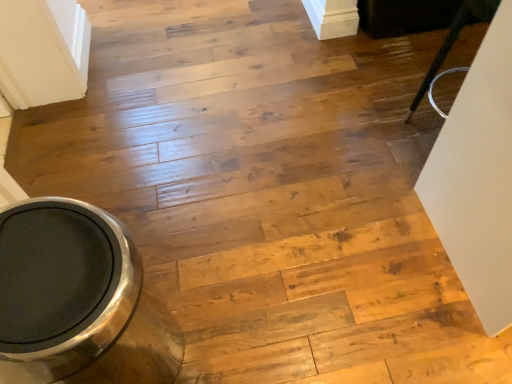
Find the location of `free space that is in between black glossy chair at upper right and polished stainless steel toilet bowl at lower left`. free space that is in between black glossy chair at upper right and polished stainless steel toilet bowl at lower left is located at coordinates (300, 236).